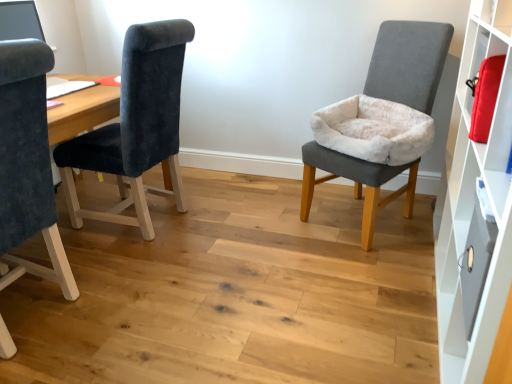
Find the location of `vacant region under velvet dark blue chair at left, the second chair positioned from the left (from a real-world perspective)`. vacant region under velvet dark blue chair at left, the second chair positioned from the left (from a real-world perspective) is located at coordinates (169, 221).